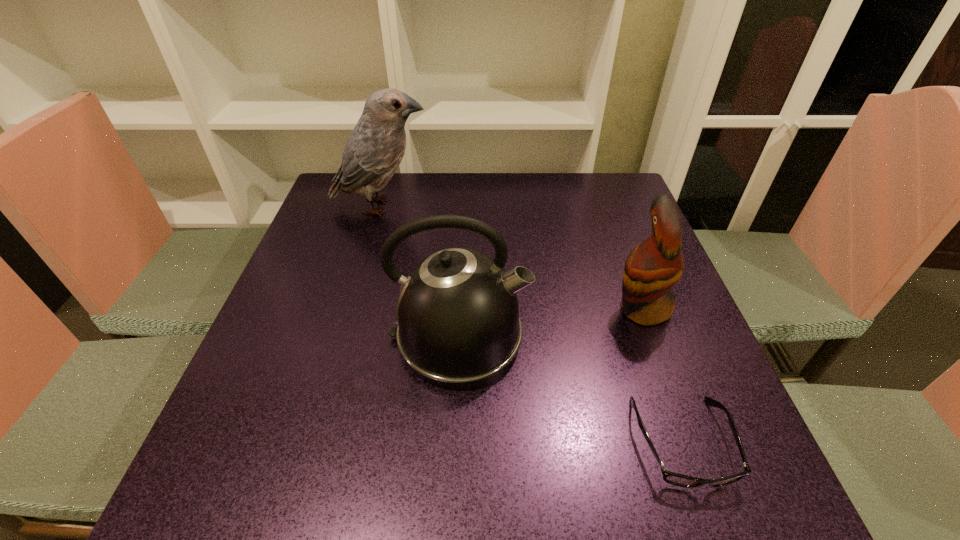
In order to click on blank region between the kettle and the shortest object in this screenshot , I will do `click(570, 390)`.

Find the location of a particular element. This screenshot has height=540, width=960. free space between the kettle and the spectacles is located at coordinates (570, 390).

This screenshot has width=960, height=540. I want to click on free area in between the shortest object and the farther parrot, so click(x=532, y=324).

Image resolution: width=960 pixels, height=540 pixels. What are the coordinates of `the third closest object relative to the shortest object` in the screenshot? It's located at (374, 150).

At what (x,y) coordinates should I click in order to perform the action: click on object identified as the second closest to the nearer parrot. Please return your answer as a coordinate pair (x, y). The image size is (960, 540). Looking at the image, I should click on (458, 320).